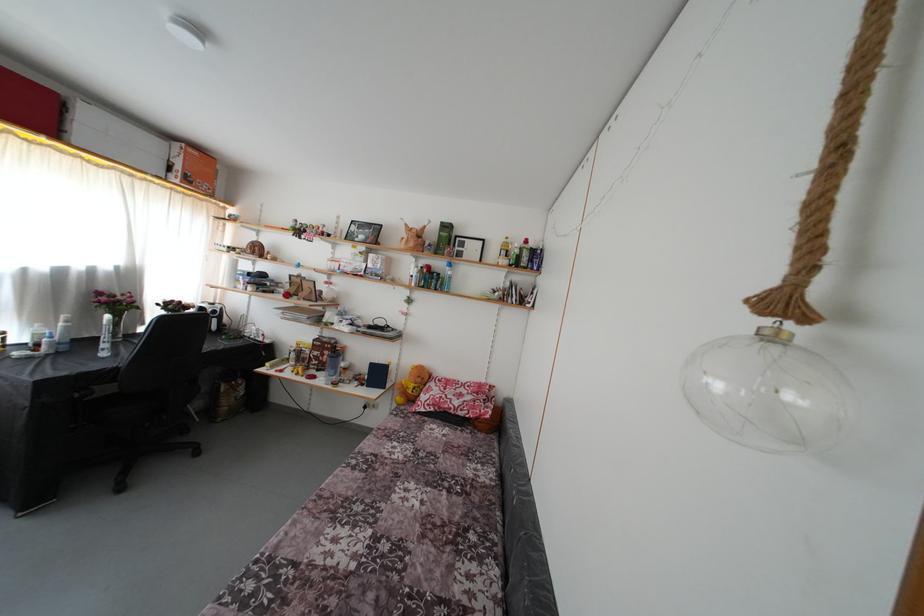
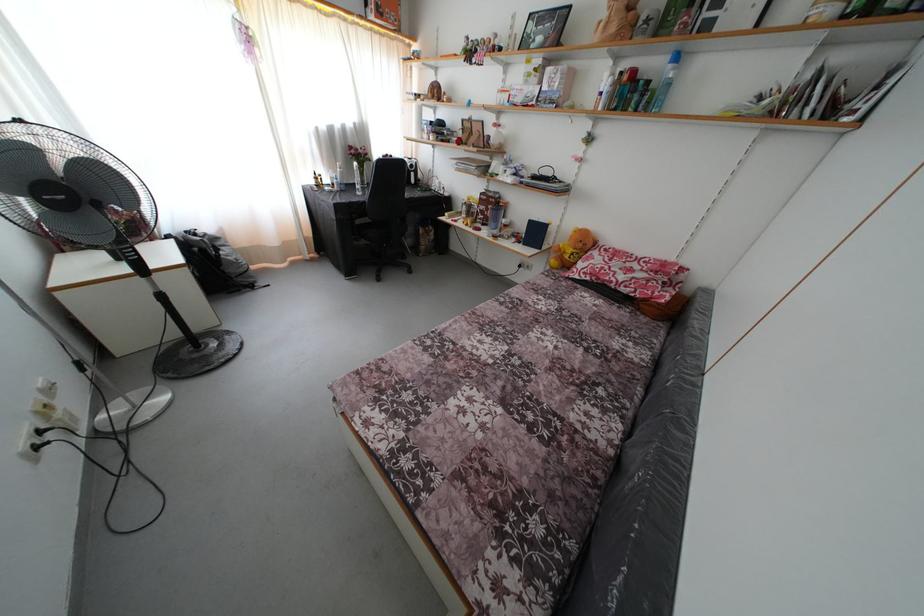
Locate, in the second image, the point that corresponds to (x=503, y=466) in the first image.

(663, 353)